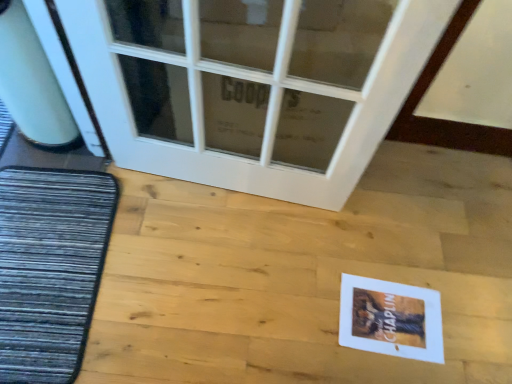
Describe the element at coordinates (50, 268) in the screenshot. I see `dark gray textured mat at left` at that location.

Locate an element on the screen. This screenshot has height=384, width=512. dark gray textured mat at left is located at coordinates (50, 268).

Could dark gray textured mat at left be considered to be inside white paper postcard at lower right?

Definitely not — dark gray textured mat at left is not inside white paper postcard at lower right.

In the image, there is a dark gray textured mat at left. Where is `postcard below it (from the image's perspective)`? The image size is (512, 384). postcard below it (from the image's perspective) is located at coordinates (391, 319).

Is white paper postcard at lower right shorter than dark gray textured mat at left?

Yes, white paper postcard at lower right is shorter than dark gray textured mat at left.

Would you say white paper postcard at lower right contains white glass door at upper center?

No, white paper postcard at lower right does not contain white glass door at upper center.

From a real-world perspective, is white paper postcard at lower right physically below white glass door at upper center?

Yes, from a real-world perspective, white paper postcard at lower right is beneath white glass door at upper center.

Between point (355, 326) and point (138, 41), which one is positioned behind?

The point (355, 326) is more distant.

Looking at their sizes, would you say white glass door at upper center is wider or thinner than white paper postcard at lower right?

white glass door at upper center is thinner than white paper postcard at lower right.

Which of these two, white glass door at upper center or white paper postcard at lower right, stands shorter?

white paper postcard at lower right.

From a real-world perspective, between white glass door at upper center and white paper postcard at lower right, who is vertically higher?

white glass door at upper center.

Does white glass door at upper center appear on the left side of white paper postcard at lower right?

Yes.

Is dark gray textured mat at left beside white paper postcard at lower right?

No.

Is white paper postcard at lower right located within dark gray textured mat at left?

No, white paper postcard at lower right is located outside of dark gray textured mat at left.

From the image's perspective, is dark gray textured mat at left above or below white paper postcard at lower right?

From the image's perspective, dark gray textured mat at left appears above white paper postcard at lower right.

Does dark gray textured mat at left have a lesser width compared to white glass door at upper center?

Incorrect, the width of dark gray textured mat at left is not less than that of white glass door at upper center.

Who is bigger, dark gray textured mat at left or white glass door at upper center?

Bigger between the two is white glass door at upper center.

Consider the image. Is dark gray textured mat at left far away from white glass door at upper center?

That's not correct — dark gray textured mat at left is a little close to white glass door at upper center.

Does white glass door at upper center have a lesser width compared to dark gray textured mat at left?

Yes, white glass door at upper center is thinner than dark gray textured mat at left.

Find the location of a particular element. The height and width of the screenshot is (384, 512). door above the dark gray textured mat at left (from the image's perspective) is located at coordinates (252, 86).

Is white glass door at upper center positioned beyond the bounds of dark gray textured mat at left?

Absolutely, white glass door at upper center is external to dark gray textured mat at left.

Consider the image. Can you tell me how much white glass door at upper center and dark gray textured mat at left differ in facing direction?

The angle between the facing direction of white glass door at upper center and the facing direction of dark gray textured mat at left is 87.1 degrees.

In the image, there is a dark gray textured mat at left. Identify the location of postcard below it (from a real-world perspective). (391, 319).

Locate an element on the screen. This screenshot has width=512, height=384. door above the white paper postcard at lower right (from a real-world perspective) is located at coordinates (252, 86).

From the image, which object appears to be farther from white paper postcard at lower right, dark gray textured mat at left or white glass door at upper center?

dark gray textured mat at left is positioned further to the anchor white paper postcard at lower right.

From the picture: Looking at the image, which one is located further to white glass door at upper center, white paper postcard at lower right or dark gray textured mat at left?

white paper postcard at lower right is positioned further to the anchor white glass door at upper center.

From the image, which object appears to be farther from dark gray textured mat at left, white glass door at upper center or white paper postcard at lower right?

white paper postcard at lower right is positioned further to the anchor dark gray textured mat at left.

Looking at the image, which one is located closer to white paper postcard at lower right, white glass door at upper center or dark gray textured mat at left?

Among the two, white glass door at upper center is located nearer to white paper postcard at lower right.

Based on their spatial positions, is white paper postcard at lower right or white glass door at upper center closer to dark gray textured mat at left?

white glass door at upper center is positioned closer to the anchor dark gray textured mat at left.

Based on their spatial positions, is dark gray textured mat at left or white paper postcard at lower right closer to white glass door at upper center?

Based on the image, dark gray textured mat at left appears to be nearer to white glass door at upper center.

Locate an element on the screen. door located between dark gray textured mat at left and white paper postcard at lower right in the left-right direction is located at coordinates (252, 86).